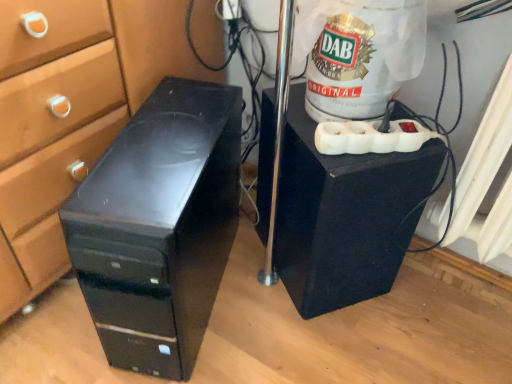
Describe the element at coordinates (159, 226) in the screenshot. The height and width of the screenshot is (384, 512). I see `black plastic computer tower at left, which ranks as the 2th furniture in right-to-left order` at that location.

I want to click on black plastic computer tower at left, which ranks as the 2th furniture in right-to-left order, so click(159, 226).

The height and width of the screenshot is (384, 512). I want to click on black matte speaker at center, which is the 2th furniture in left-to-right order, so click(x=344, y=215).

The height and width of the screenshot is (384, 512). What do you see at coordinates (344, 215) in the screenshot? I see `black matte speaker at center, which is the 2th furniture in left-to-right order` at bounding box center [344, 215].

Image resolution: width=512 pixels, height=384 pixels. What are the coordinates of `black plastic computer tower at left, which ranks as the 2th furniture in right-to-left order` in the screenshot? It's located at (159, 226).

Does black plastic computer tower at left, arranged as the first furniture when viewed from the left, appear on the right side of black matte speaker at center, which is the 2th furniture in left-to-right order?

In fact, black plastic computer tower at left, arranged as the first furniture when viewed from the left, is to the left of black matte speaker at center, which is the 2th furniture in left-to-right order.

Is black plastic computer tower at left, which ranks as the 2th furniture in right-to-left order, positioned in front of black matte speaker at center, which ranks as the 1th furniture in right-to-left order?

Yes.

Which is closer to the camera, (97, 276) or (380, 282)?

The point (97, 276) is in front.

Looking at this image, from the image's perspective, which one is positioned lower, black plastic computer tower at left, arranged as the first furniture when viewed from the left, or black matte speaker at center, which ranks as the 1th furniture in right-to-left order?

From the image's view, black plastic computer tower at left, arranged as the first furniture when viewed from the left, is below.

From a real-world perspective, between black plastic computer tower at left, arranged as the first furniture when viewed from the left, and black matte speaker at center, which is the 2th furniture in left-to-right order, who is vertically higher?

black plastic computer tower at left, arranged as the first furniture when viewed from the left, from a real-world perspective.

Between black plastic computer tower at left, arranged as the first furniture when viewed from the left, and black matte speaker at center, which ranks as the 1th furniture in right-to-left order, which one has larger width?

black plastic computer tower at left, arranged as the first furniture when viewed from the left, is wider.

Is black plastic computer tower at left, which ranks as the 2th furniture in right-to-left order, taller than black matte speaker at center, which is the 2th furniture in left-to-right order?

Yes.

Considering the sizes of objects black plastic computer tower at left, arranged as the first furniture when viewed from the left, and black matte speaker at center, which is the 2th furniture in left-to-right order, in the image provided, who is smaller, black plastic computer tower at left, arranged as the first furniture when viewed from the left, or black matte speaker at center, which is the 2th furniture in left-to-right order,?

Smaller between the two is black matte speaker at center, which is the 2th furniture in left-to-right order.

Would you say black plastic computer tower at left, which ranks as the 2th furniture in right-to-left order, is inside or outside black matte speaker at center, which is the 2th furniture in left-to-right order?

The correct answer is: outside.

Is black plastic computer tower at left, arranged as the first furniture when viewed from the left, touching black matte speaker at center, which ranks as the 1th furniture in right-to-left order?

No, black plastic computer tower at left, arranged as the first furniture when viewed from the left, is not making contact with black matte speaker at center, which ranks as the 1th furniture in right-to-left order.

Is black plastic computer tower at left, arranged as the first furniture when viewed from the left, facing towards black matte speaker at center, which ranks as the 1th furniture in right-to-left order?

No, black plastic computer tower at left, arranged as the first furniture when viewed from the left, is not facing towards black matte speaker at center, which ranks as the 1th furniture in right-to-left order.

What's the angular difference between black plastic computer tower at left, arranged as the first furniture when viewed from the left, and black matte speaker at center, which is the 2th furniture in left-to-right order,'s facing directions?

The angle between the facing direction of black plastic computer tower at left, arranged as the first furniture when viewed from the left, and the facing direction of black matte speaker at center, which is the 2th furniture in left-to-right order, is 31.3 degrees.

Locate an element on the screen. The width and height of the screenshot is (512, 384). furniture below the black matte speaker at center, which is the 2th furniture in left-to-right order (from the image's perspective) is located at coordinates (159, 226).

In the scene shown: Which object is positioned more to the left, black matte speaker at center, which is the 2th furniture in left-to-right order, or black plastic computer tower at left, arranged as the first furniture when viewed from the left?

black plastic computer tower at left, arranged as the first furniture when viewed from the left, is more to the left.

Which object is closer to the camera, black matte speaker at center, which ranks as the 1th furniture in right-to-left order, or black plastic computer tower at left, which ranks as the 2th furniture in right-to-left order?

Positioned in front is black plastic computer tower at left, which ranks as the 2th furniture in right-to-left order.

Which is closer to the camera, (317, 266) or (134, 261)?

The point (134, 261) is more forward.

From the image's perspective, which one is positioned lower, black matte speaker at center, which ranks as the 1th furniture in right-to-left order, or black plastic computer tower at left, arranged as the first furniture when viewed from the left?

From the image's view, black plastic computer tower at left, arranged as the first furniture when viewed from the left, is below.

From a real-world perspective, is black matte speaker at center, which ranks as the 1th furniture in right-to-left order, physically located above or below black plastic computer tower at left, arranged as the first furniture when viewed from the left?

From a real-world perspective, black matte speaker at center, which ranks as the 1th furniture in right-to-left order, is physically below black plastic computer tower at left, arranged as the first furniture when viewed from the left.

Which object is wider, black matte speaker at center, which is the 2th furniture in left-to-right order, or black plastic computer tower at left, which ranks as the 2th furniture in right-to-left order?

black plastic computer tower at left, which ranks as the 2th furniture in right-to-left order.

Can you confirm if black matte speaker at center, which is the 2th furniture in left-to-right order, is shorter than black plastic computer tower at left, which ranks as the 2th furniture in right-to-left order?

Indeed, black matte speaker at center, which is the 2th furniture in left-to-right order, has a lesser height compared to black plastic computer tower at left, which ranks as the 2th furniture in right-to-left order.

Which of these two, black matte speaker at center, which ranks as the 1th furniture in right-to-left order, or black plastic computer tower at left, which ranks as the 2th furniture in right-to-left order, is bigger?

black plastic computer tower at left, which ranks as the 2th furniture in right-to-left order.

Is black matte speaker at center, which ranks as the 1th furniture in right-to-left order, surrounding black plastic computer tower at left, arranged as the first furniture when viewed from the left?

That's incorrect, black plastic computer tower at left, arranged as the first furniture when viewed from the left, is not inside black matte speaker at center, which ranks as the 1th furniture in right-to-left order.

Are black matte speaker at center, which ranks as the 1th furniture in right-to-left order, and black plastic computer tower at left, which ranks as the 2th furniture in right-to-left order, far apart?

That's not correct — black matte speaker at center, which ranks as the 1th furniture in right-to-left order, is a little close to black plastic computer tower at left, which ranks as the 2th furniture in right-to-left order.

Is black matte speaker at center, which ranks as the 1th furniture in right-to-left order, oriented towards black plastic computer tower at left, which ranks as the 2th furniture in right-to-left order?

No.

Can you tell me how much black matte speaker at center, which ranks as the 1th furniture in right-to-left order, and black plastic computer tower at left, which ranks as the 2th furniture in right-to-left order, differ in facing direction?

There is a 31.3-degree angle between the facing directions of black matte speaker at center, which ranks as the 1th furniture in right-to-left order, and black plastic computer tower at left, which ranks as the 2th furniture in right-to-left order.

Find the location of `furniture above the black plastic computer tower at left, arranged as the first furniture when viewed from the left (from the image's perspective)`. furniture above the black plastic computer tower at left, arranged as the first furniture when viewed from the left (from the image's perspective) is located at coordinates (344, 215).

Locate an element on the screen. This screenshot has height=384, width=512. furniture above the black matte speaker at center, which is the 2th furniture in left-to-right order (from a real-world perspective) is located at coordinates (159, 226).

Identify the location of furniture below the black matte speaker at center, which ranks as the 1th furniture in right-to-left order (from the image's perspective). (159, 226).